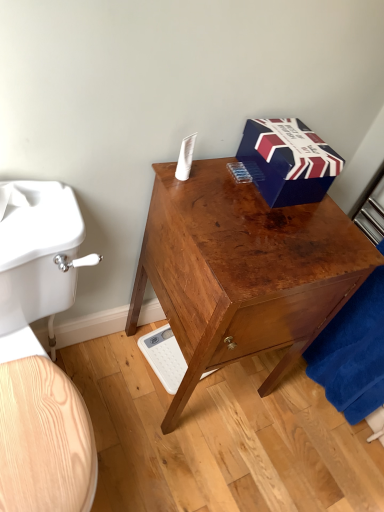
Locate an element on the screen. blank space situated above shiny brown wooden desk at center (from a real-world perspective) is located at coordinates (274, 219).